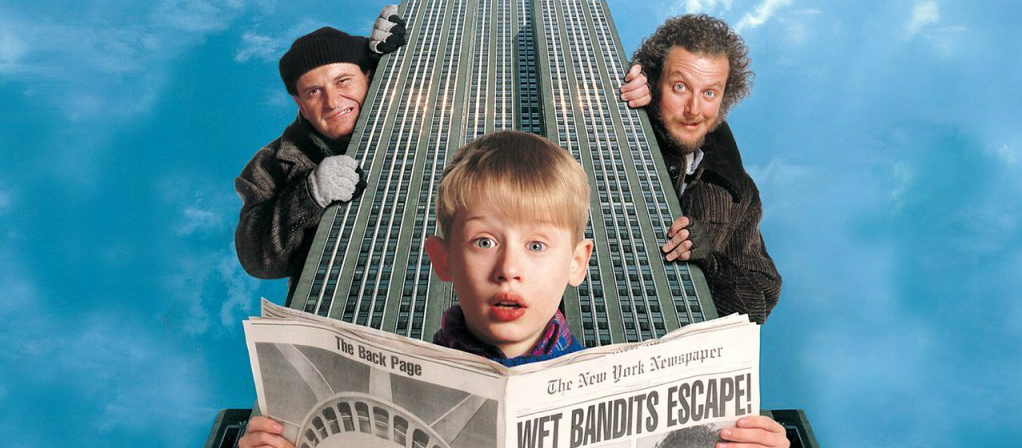
You are a GUI agent. You are given a task and a screenshot of the screen. Output one action in this format:
    pyautogui.click(x=<x>, y=<y>)
    Task: Click on the newspaper
    
    Given the screenshot: What is the action you would take?
    pyautogui.click(x=743, y=333)